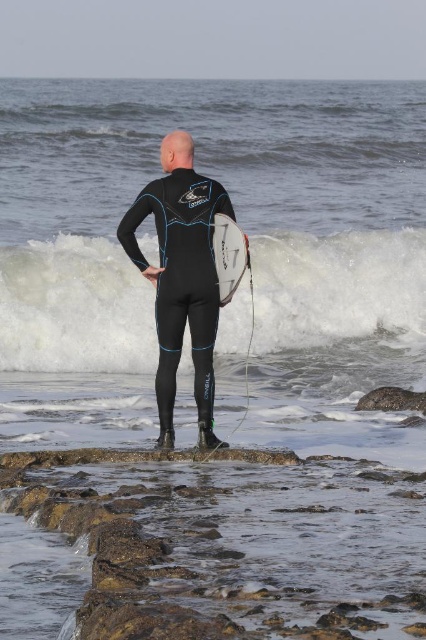
You are a surfer standing on the rocky ledge and see the white foam wave at center. If you want to reach the wave quickly, should you move towards or away from the ocean?

The white foam wave at center is 53.58 feet away from the viewer. To reach it quickly, you should move towards the ocean since the wave is in that direction.

You are a photographer positioned at the camera location. You want to capture a closeup shot of the point at coordinates point (x=411, y=342). Given that your camera can focus up to 60 feet away, will you be able to capture the point clearly?

The distance of point (x=411, y=342) from camera is 62.29 feet, which is beyond the camera focus limit of 60 feet. Therefore, the point cannot be captured clearly.

You are a lifeguard observing the scene from a tower. You see the white foam wave at center and the black matte wetsuit at center. Which object is closer to the ocean?

The white foam wave at center is further to the viewer than the black matte wetsuit at center, so the black matte wetsuit at center is closer to the ocean.